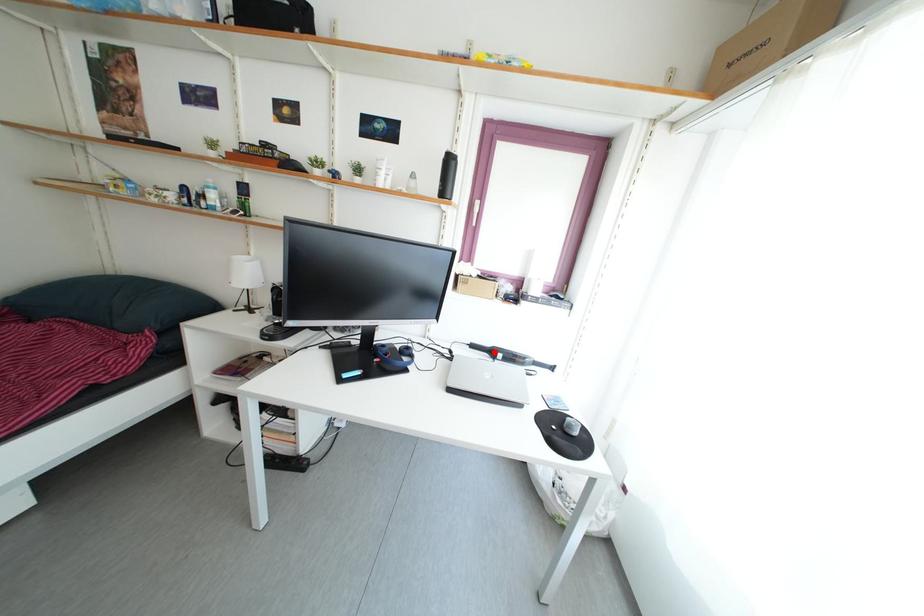
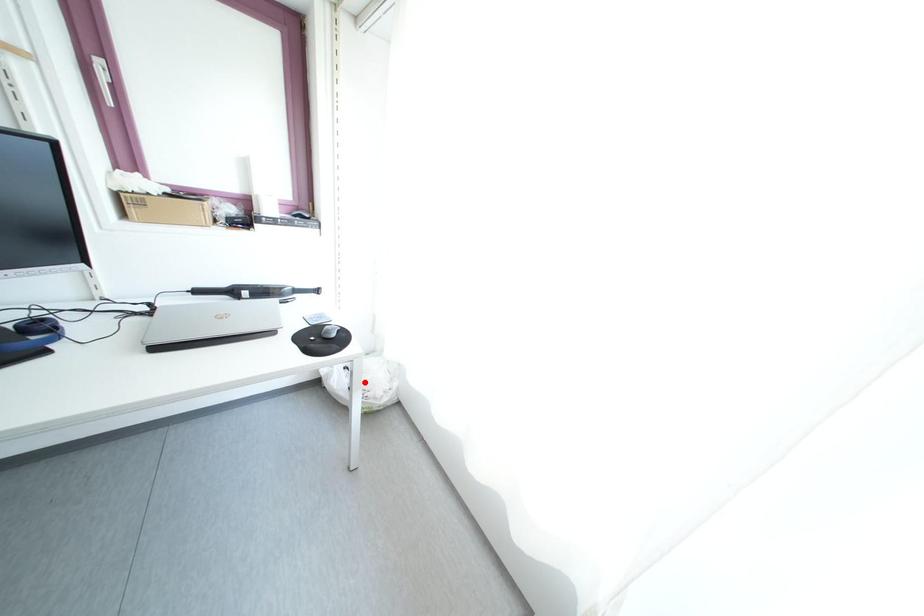
I am providing you with two images of the same scene from different viewpoints. A red point is marked on the first image and another point is marked on the second image. Does the point marked in image1 correspond to the same location as the one in image2?

No